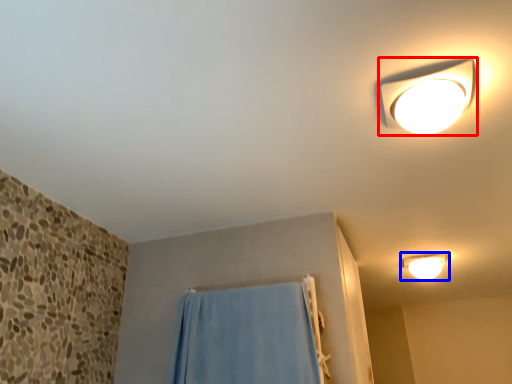
Question: Which point is further to the camera, lamp (highlighted by a red box) or lamp (highlighted by a blue box)?

Choices:
 (A) lamp
 (B) lamp

Answer: (B)